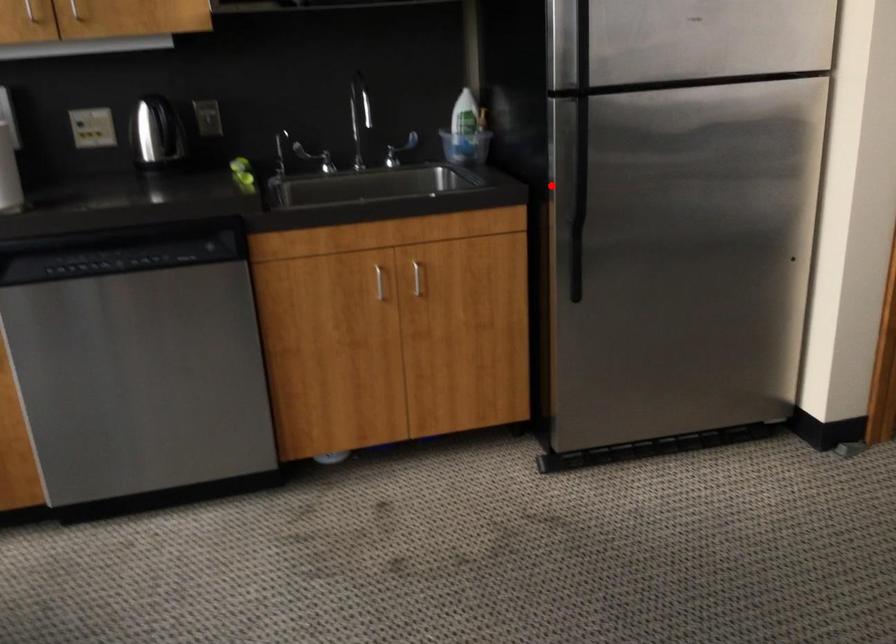
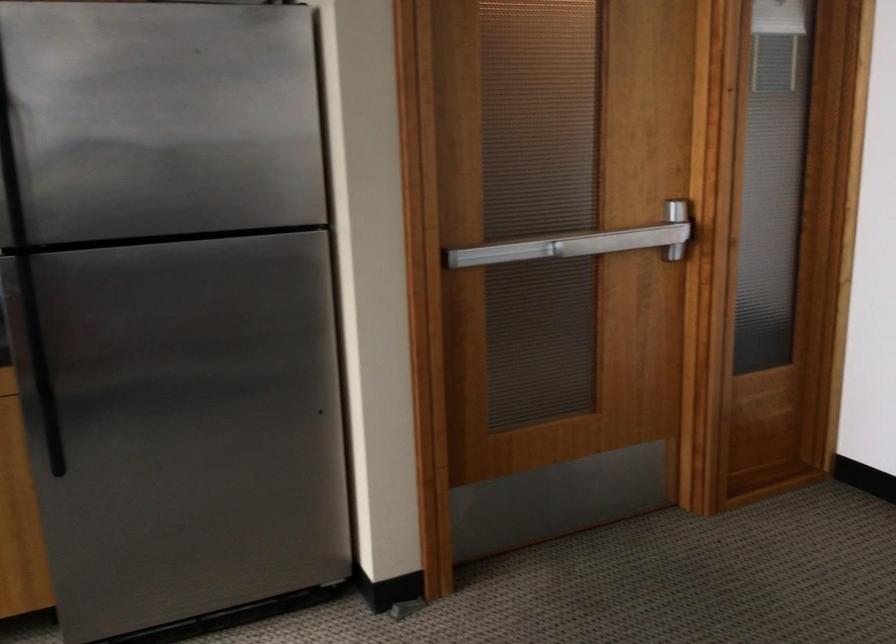
Question: I am providing you with two images of the same scene from different viewpoints. Image1 has a red point marked. In image2, the corresponding 3D location appears at what relative position? Reply with the corresponding letter.

Choices:
 (A) Closer
 (B) Farther

Answer: (A)